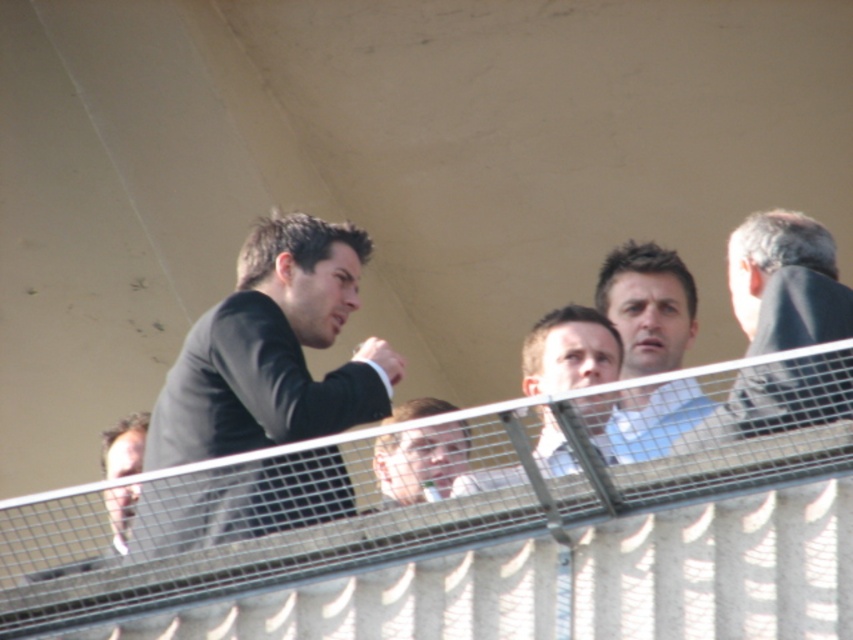
Question: Is light blue shirt at center above smooth brown hair at left?

Choices:
 (A) yes
 (B) no

Answer: (A)

Question: Based on their relative distances, which object is farther from the light blue shirt at center?

Choices:
 (A) white shirt at center
 (B) smooth brown hair at left

Answer: (B)

Question: Is dark gray suit at upper left further to camera compared to white shirt at center?

Choices:
 (A) yes
 (B) no

Answer: (A)

Question: Among these points, which one is farthest from the camera?

Choices:
 (A) (264, 330)
 (B) (381, 435)
 (C) (582, 404)
 (D) (436, 573)

Answer: (C)

Question: Estimate the real-world distances between objects in this image. Which object is farther from the white shirt at center?

Choices:
 (A) smooth brown hair at left
 (B) dark gray suit at right

Answer: (A)

Question: Can you confirm if dark gray suit at right is thinner than smooth brown hair at left?

Choices:
 (A) no
 (B) yes

Answer: (B)